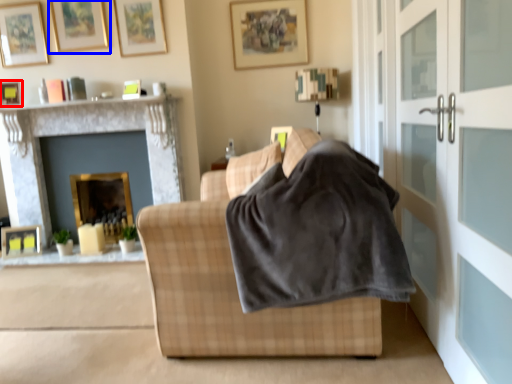
Question: Which object is further to the camera taking this photo, picture frame (highlighted by a red box) or picture frame (highlighted by a blue box)?

Choices:
 (A) picture frame
 (B) picture frame

Answer: (B)